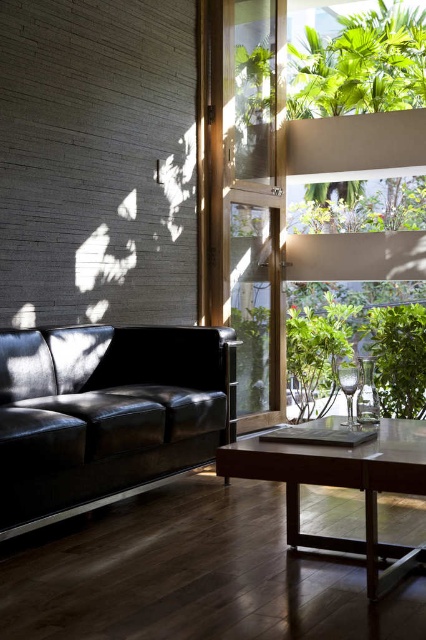
You are a guest entering the living room and want to exit through the transparent glass door at upper center. Which direction should you walk relative to the matte black leather couch at left?

The transparent glass door at upper center is positioned on the right side of the matte black leather couch at left, so you should walk to the right relative to the matte black leather couch at left to reach the door.

You are a delivery person who needs to place a 1.2 meter tall package on the floor. You see the glossy wood table at center and the green leafy plant at center. Which object is shorter and can accommodate the package underneath it?

The glossy wood table at center is not as tall as the green leafy plant at center, so the glossy wood table at center is shorter and can accommodate the package underneath it.

You are a delivery person trying to enter the living room through the transparent glass door at upper center. There is a green leafy plant at right nearby. Can you carry a large package that is 1.2 meters wide through the door without bending it?

The transparent glass door at upper center is larger in size than green leafy plant at right. However, the exact dimensions of the door are not provided, so it is uncertain if the 1.2 meter wide package can fit through the transparent glass door at upper center without bending it.